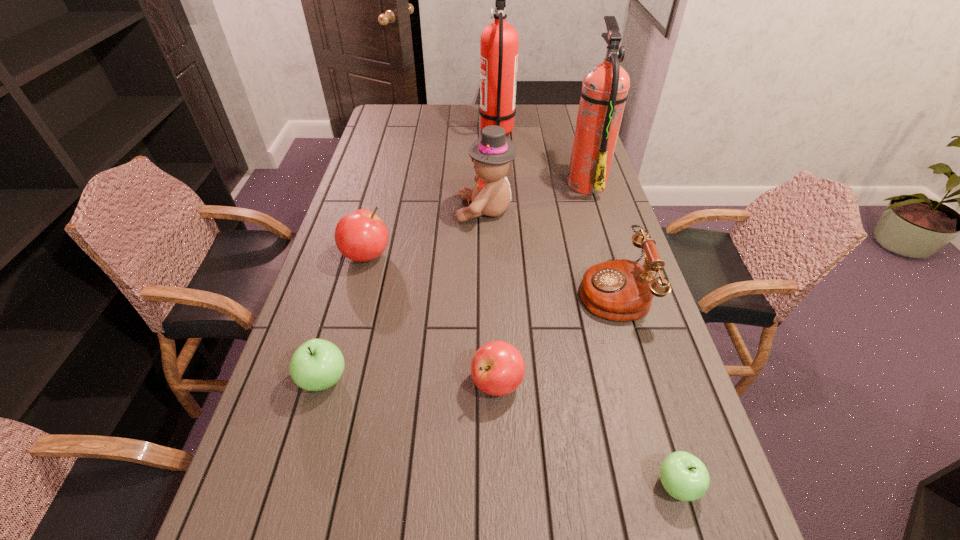
Identify the location of the nearer red apple. (497, 368).

Locate an element on the screen. Image resolution: width=960 pixels, height=540 pixels. the shortest apple is located at coordinates (684, 477).

Find the location of a particular element. Image resolution: width=960 pixels, height=540 pixels. the shortest object is located at coordinates (684, 477).

The height and width of the screenshot is (540, 960). In order to click on vacant space located 0.370m on the handle side of the red fire extinguisher in this screenshot , I will do `click(392, 132)`.

Locate an element on the screen. free location located 0.090m on the handle side of the red fire extinguisher is located at coordinates (458, 132).

The width and height of the screenshot is (960, 540). I want to click on vacant space situated on the handle side of the red fire extinguisher, so click(x=461, y=132).

Find the location of a particular element. Image resolution: width=960 pixels, height=540 pixels. free space located at the nozzle of the nearer fire extinguisher is located at coordinates (525, 183).

This screenshot has width=960, height=540. Identify the location of free space located at the nozzle of the nearer fire extinguisher. (522, 183).

Where is `free region located 0.380m at the nozzle of the nearer fire extinguisher`? This screenshot has width=960, height=540. free region located 0.380m at the nozzle of the nearer fire extinguisher is located at coordinates (462, 183).

Locate an element on the screen. This screenshot has height=540, width=960. free space located 0.160m on the front-facing side of the rag_doll is located at coordinates (409, 210).